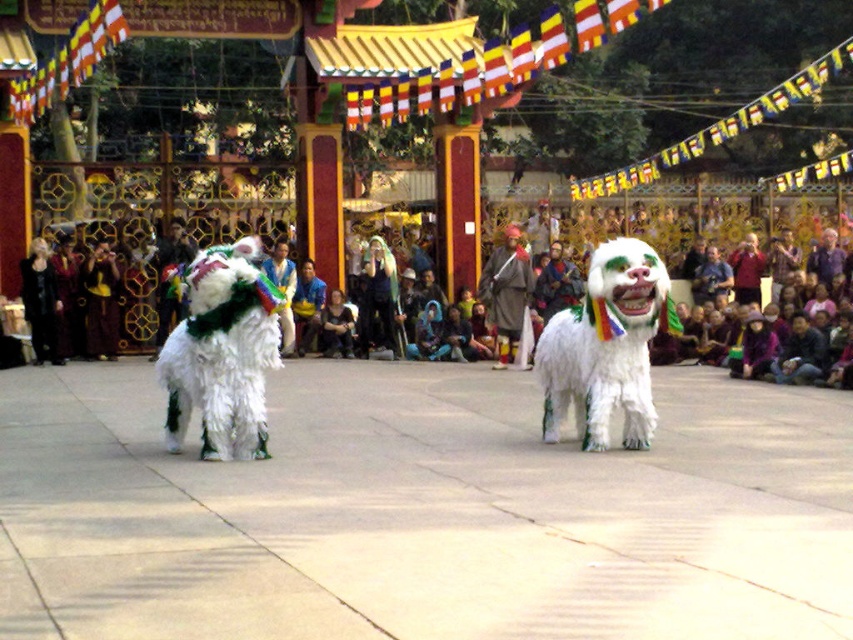
Question: From the image, what is the correct spatial relationship of multicolored fabric crowd at center in relation to matte green costume at center?

Choices:
 (A) above
 (B) below

Answer: (A)

Question: Which object is the farthest from the dark blue fabric jacket at center?

Choices:
 (A) yellow silk robe at center
 (B) green fuzzy costume at center
 (C) black velvet dress at center
 (D) white fur costume at center

Answer: (C)

Question: Which object is the closest to the multicolored fabric crowd at center?

Choices:
 (A) matte green costume at center
 (B) dark blue fabric jacket at center
 (C) black velvet dress at center
 (D) yellow silk robe at center

Answer: (B)

Question: Which object is the closest to the green fuzzy costume at center?

Choices:
 (A) dark blue fabric jacket at center
 (B) white fur costume at center
 (C) multicolored fabric crowd at center

Answer: (B)

Question: Can you confirm if multicolored fabric crowd at center is positioned to the right of white fur costume at center?

Choices:
 (A) yes
 (B) no

Answer: (A)

Question: Is the position of yellow silk robe at center more distant than that of dark blue fabric jacket at center?

Choices:
 (A) yes
 (B) no

Answer: (B)